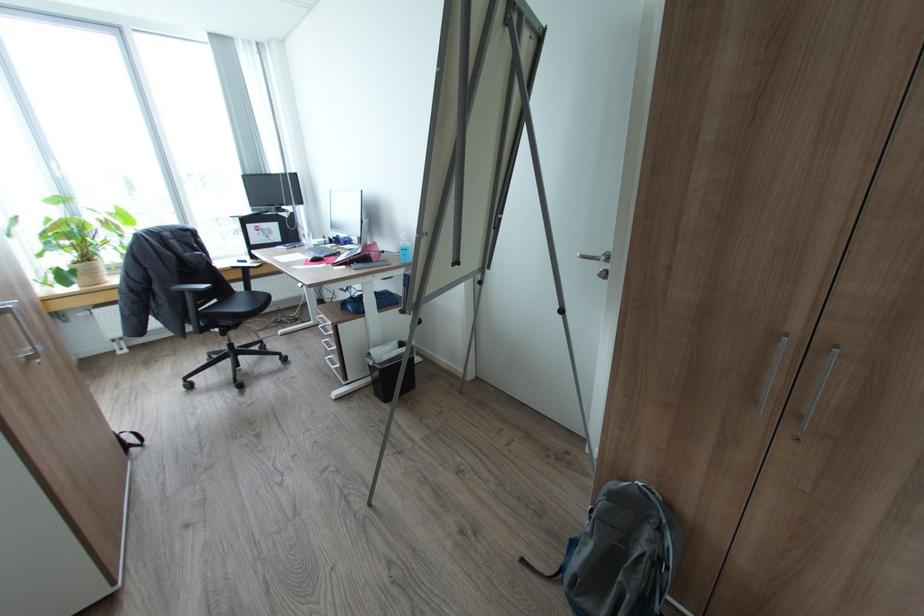
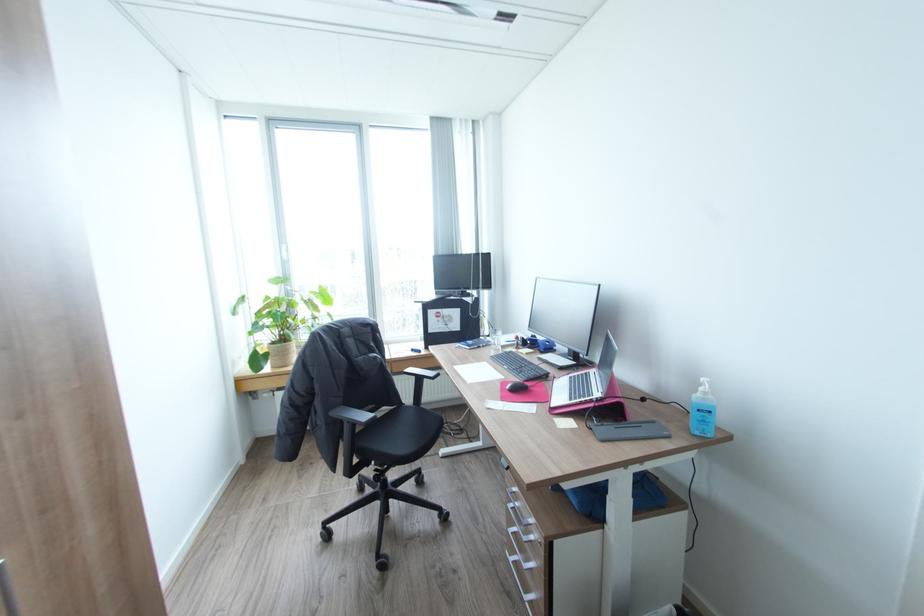
In the second image, find the point that corresponds to [195,292] in the first image.

(354, 422)